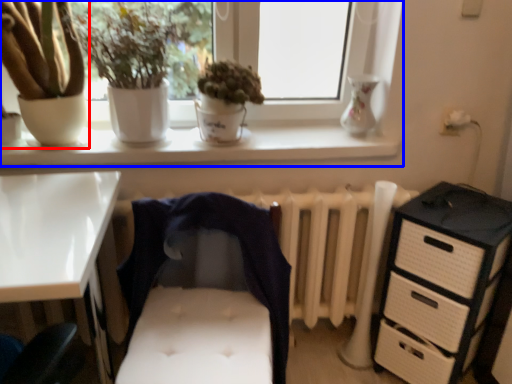
Question: Among these objects, which one is farthest to the camera, houseplant (highlighted by a red box) or window (highlighted by a blue box)?

Choices:
 (A) houseplant
 (B) window

Answer: (B)